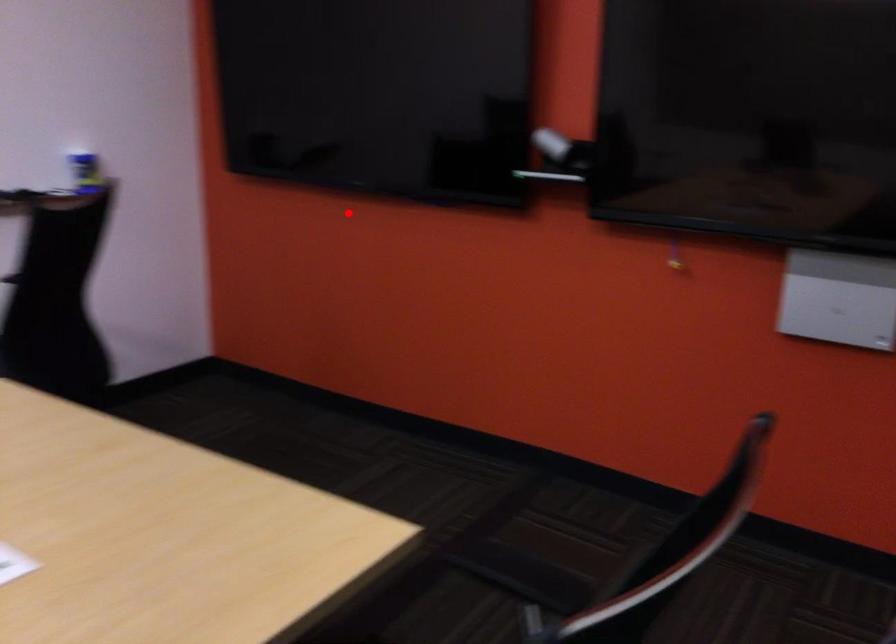
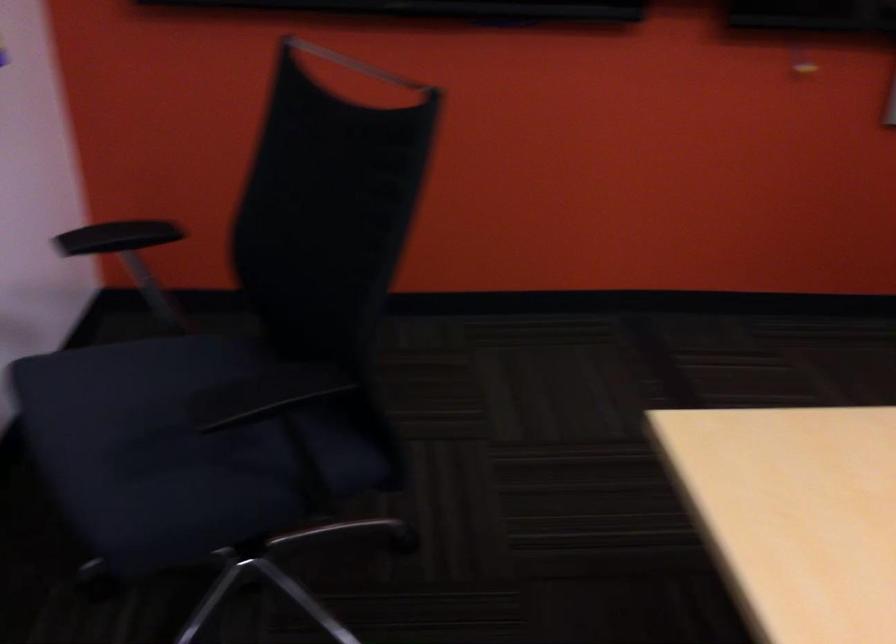
Find the pixel in the second image that matches the highlighted location in the first image.

(356, 64)